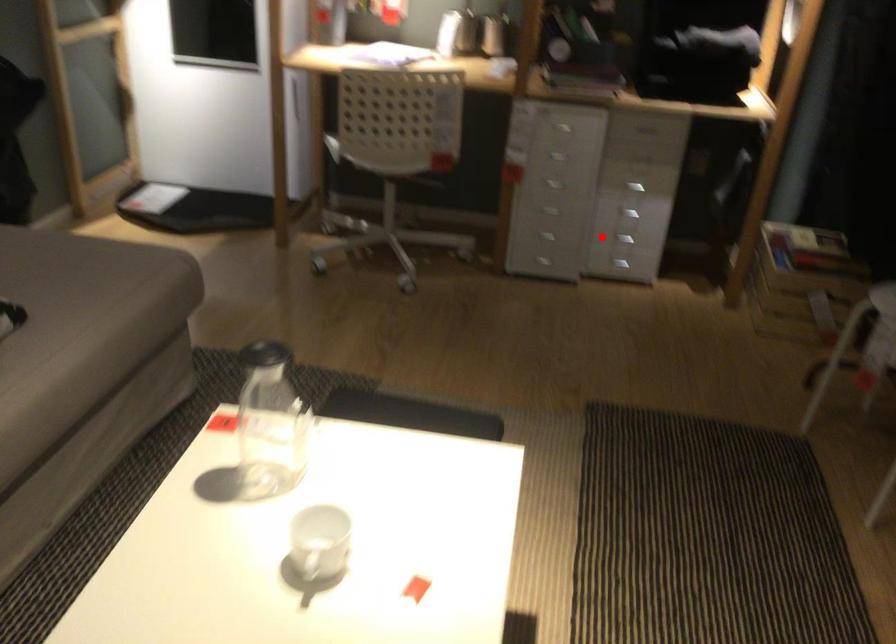
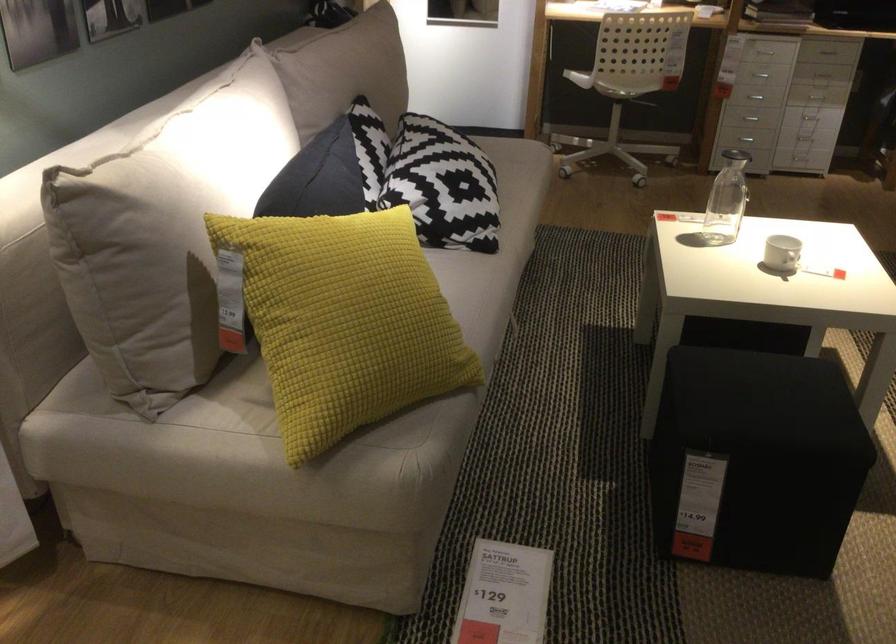
The point at the highlighted location is marked in the first image. Where is the corresponding point in the second image?

(810, 118)